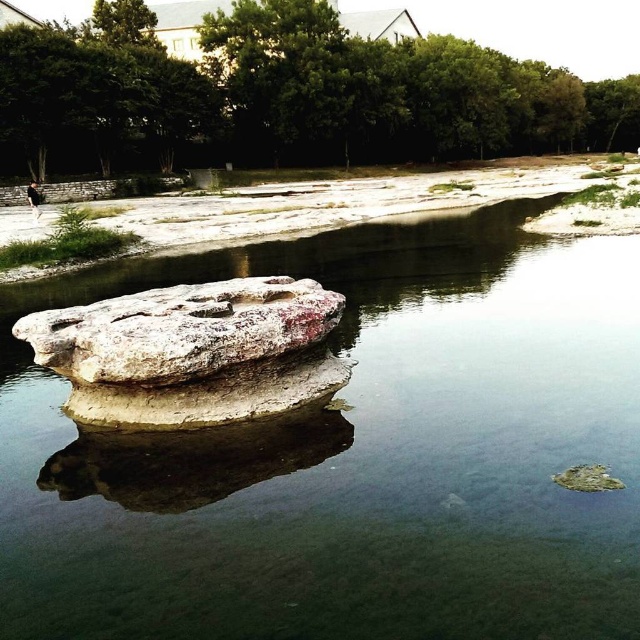
You are standing at the edge of the water and want to place a small floating toy boat in the scene. Which object, the clear water at center or the white rough rock at center, would allow the boat to float on its surface?

The clear water at center is taller than the white rough rock at center, so the boat can float on the clear water at center since water surfaces are buoyant, while the rock is solid and cannot support floating objects.

You are standing at the point closest to the camera in the image. Which point, point (484, 563) or point (193, 332), are you currently at?

You are at point (484, 563) because it is closer to the camera than point (193, 332).